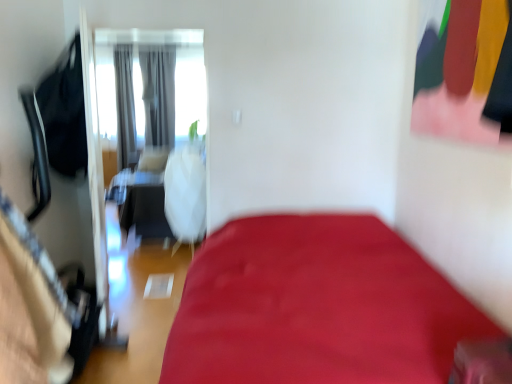
Question: Should I look upward or downward to see white matte screen door at upper left?

Choices:
 (A) up
 (B) down

Answer: (A)

Question: Is the depth of gray fabric curtain at center, the 2th curtain in the left-to-right sequence, greater than that of gray fabric curtain at upper left, which appears as the 2th curtain when viewed from the right?

Choices:
 (A) no
 (B) yes

Answer: (B)

Question: Is gray fabric curtain at center, the 2th curtain in the left-to-right sequence, located outside gray fabric curtain at upper left, the 1th curtain in the left-to-right sequence?

Choices:
 (A) yes
 (B) no

Answer: (A)

Question: Would you say gray fabric curtain at upper left, which appears as the 2th curtain when viewed from the right, is part of gray fabric curtain at center, the 1th curtain viewed from the right,'s contents?

Choices:
 (A) no
 (B) yes

Answer: (A)

Question: Is gray fabric curtain at center, the 2th curtain in the left-to-right sequence, facing away from gray fabric curtain at upper left, which appears as the 2th curtain when viewed from the right?

Choices:
 (A) no
 (B) yes

Answer: (A)

Question: Can you confirm if gray fabric curtain at center, the 1th curtain viewed from the right, is smaller than gray fabric curtain at upper left, the 1th curtain in the left-to-right sequence?

Choices:
 (A) no
 (B) yes

Answer: (A)

Question: Is the position of gray fabric curtain at center, the 2th curtain in the left-to-right sequence, less distant than that of gray fabric curtain at upper left, the 1th curtain in the left-to-right sequence?

Choices:
 (A) yes
 (B) no

Answer: (B)

Question: From the image's perspective, does matte black clothing at upper right appear higher than gray fabric curtain at upper left, which appears as the 2th curtain when viewed from the right?

Choices:
 (A) yes
 (B) no

Answer: (B)

Question: Is matte black clothing at upper right to the right of gray fabric curtain at upper left, which appears as the 2th curtain when viewed from the right, from the viewer's perspective?

Choices:
 (A) yes
 (B) no

Answer: (A)

Question: From a real-world perspective, does matte black clothing at upper right sit lower than gray fabric curtain at upper left, which appears as the 2th curtain when viewed from the right?

Choices:
 (A) no
 (B) yes

Answer: (A)

Question: Is matte black clothing at upper right taller than gray fabric curtain at upper left, the 1th curtain in the left-to-right sequence?

Choices:
 (A) yes
 (B) no

Answer: (B)

Question: From a real-world perspective, does matte black clothing at upper right stand above gray fabric curtain at upper left, the 1th curtain in the left-to-right sequence?

Choices:
 (A) no
 (B) yes

Answer: (B)

Question: Is matte black clothing at upper right next to gray fabric curtain at upper left, the 1th curtain in the left-to-right sequence, and touching it?

Choices:
 (A) yes
 (B) no

Answer: (B)

Question: Considering the relative positions of gray fabric curtain at upper left, which appears as the 2th curtain when viewed from the right, and white matte screen door at upper left in the image provided, is gray fabric curtain at upper left, which appears as the 2th curtain when viewed from the right, to the left of white matte screen door at upper left from the viewer's perspective?

Choices:
 (A) no
 (B) yes

Answer: (B)